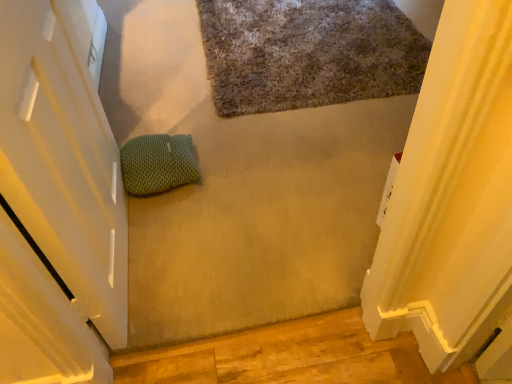
What do you see at coordinates (308, 53) in the screenshot? I see `textured gray bath mat at upper center` at bounding box center [308, 53].

The height and width of the screenshot is (384, 512). Identify the location of textured gray bath mat at upper center. (308, 53).

You are a GUI agent. You are given a task and a screenshot of the screen. Output one action in this format:
    pyautogui.click(x=<x>, y=<y>)
    Task: Click on the green mesh pillow at center
    Image resolution: width=512 pixels, height=384 pixels.
    Given the screenshot: What is the action you would take?
    pyautogui.click(x=158, y=164)

Image resolution: width=512 pixels, height=384 pixels. What do you see at coordinates (158, 164) in the screenshot? I see `green mesh pillow at center` at bounding box center [158, 164].

The width and height of the screenshot is (512, 384). Find the location of `textured gray bath mat at upper center`. textured gray bath mat at upper center is located at coordinates (308, 53).

Which object is positioned more to the left, green mesh pillow at center or textured gray bath mat at upper center?

Positioned to the left is green mesh pillow at center.

Is green mesh pillow at center positioned before textured gray bath mat at upper center?

Yes, it is.

Considering the positions of point (173, 167) and point (241, 80), is point (173, 167) closer or farther from the camera than point (241, 80)?

Point (173, 167) is closer to the camera than point (241, 80).

From the image's perspective, which is below, green mesh pillow at center or textured gray bath mat at upper center?

green mesh pillow at center, from the image's perspective.

From a real-world perspective, which object rests below the other?

textured gray bath mat at upper center.

Does green mesh pillow at center have a greater width compared to textured gray bath mat at upper center?

Incorrect, the width of green mesh pillow at center does not surpass that of textured gray bath mat at upper center.

Which of these two, green mesh pillow at center or textured gray bath mat at upper center, stands shorter?

With less height is textured gray bath mat at upper center.

Considering the sizes of green mesh pillow at center and textured gray bath mat at upper center in the image, is green mesh pillow at center bigger or smaller than textured gray bath mat at upper center?

In the image, green mesh pillow at center appears to be smaller than textured gray bath mat at upper center.

In the scene shown: Is green mesh pillow at center completely or partially outside of textured gray bath mat at upper center?

green mesh pillow at center lies outside textured gray bath mat at upper center's area.

Are green mesh pillow at center and textured gray bath mat at upper center far apart?

green mesh pillow at center is near textured gray bath mat at upper center, not far away.

Is green mesh pillow at center facing towards textured gray bath mat at upper center?

No, green mesh pillow at center is not facing towards textured gray bath mat at upper center.

You are a GUI agent. You are given a task and a screenshot of the screen. Output one action in this format:
    pyautogui.click(x=<x>, y=<y>)
    Task: Click on the bath mat on the right of the green mesh pillow at center
    This screenshot has width=512, height=384.
    Given the screenshot: What is the action you would take?
    pyautogui.click(x=308, y=53)

Is textured gray bath mat at upper center to the right of green mesh pillow at center from the viewer's perspective?

Correct, you'll find textured gray bath mat at upper center to the right of green mesh pillow at center.

Between textured gray bath mat at upper center and green mesh pillow at center, which one is positioned behind?

textured gray bath mat at upper center is further from the camera.

Is point (364, 58) more distant than point (161, 186)?

Yes, point (364, 58) is behind point (161, 186).

From the image's perspective, which is above, textured gray bath mat at upper center or green mesh pillow at center?

textured gray bath mat at upper center appears higher in the image.

From a real-world perspective, which is physically below, textured gray bath mat at upper center or green mesh pillow at center?

textured gray bath mat at upper center.

Consider the image. Which of these two, textured gray bath mat at upper center or green mesh pillow at center, is thinner?

green mesh pillow at center is thinner.

From the picture: Is textured gray bath mat at upper center taller than green mesh pillow at center?

No.

Considering the sizes of objects textured gray bath mat at upper center and green mesh pillow at center in the image provided, who is bigger, textured gray bath mat at upper center or green mesh pillow at center?

With larger size is textured gray bath mat at upper center.

Choose the correct answer: Is textured gray bath mat at upper center inside green mesh pillow at center or outside it?

textured gray bath mat at upper center is not inside green mesh pillow at center, it's outside.

Would you say textured gray bath mat at upper center is a long distance from green mesh pillow at center?

No, textured gray bath mat at upper center is not far away from green mesh pillow at center.

Is textured gray bath mat at upper center positioned with its back to green mesh pillow at center?

That's not correct — textured gray bath mat at upper center is not looking away from green mesh pillow at center.

How far apart are textured gray bath mat at upper center and green mesh pillow at center?

The distance of textured gray bath mat at upper center from green mesh pillow at center is 34.98 inches.

Identify the location of pillow on the left of the textured gray bath mat at upper center. coord(158,164).

Identify the location of bath mat that is under the green mesh pillow at center (from a real-world perspective). (308, 53).

At what (x,y) coordinates should I click in order to perform the action: click on bath mat that appears on the right of green mesh pillow at center. Please return your answer as a coordinate pair (x, y). Looking at the image, I should click on (308, 53).